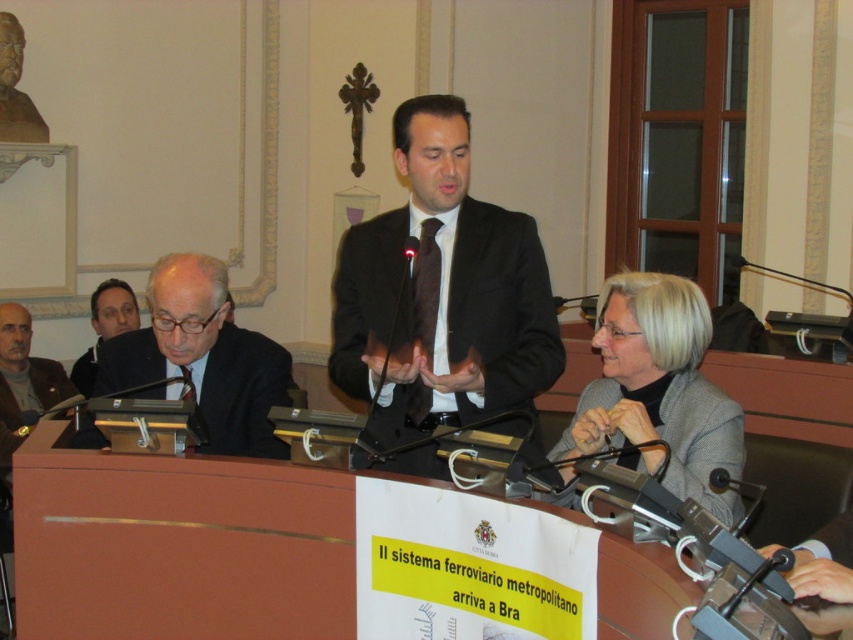
You are attending this formal event and need to sit between the black suit at center and the gray wool sweater at left. Which direction should you choose to sit between them?

You should sit to the right of the gray wool sweater at left and to the left of the black suit at center since the black suit at center is positioned to the right of the gray wool sweater at left.